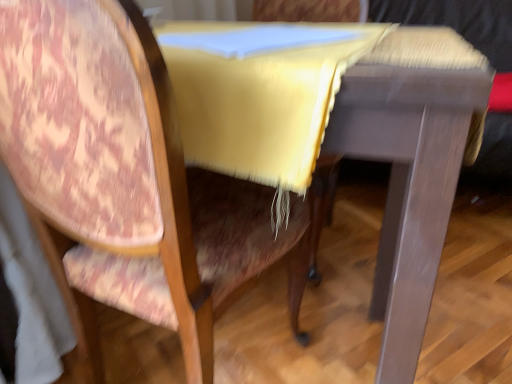
Question: Does wooden table at center appear on the left side of velvet-like pink chair at left?

Choices:
 (A) no
 (B) yes

Answer: (A)

Question: Is wooden table at center outside of velvet-like pink chair at left?

Choices:
 (A) yes
 (B) no

Answer: (B)

Question: From a real-world perspective, is wooden table at center beneath velvet-like pink chair at left?

Choices:
 (A) yes
 (B) no

Answer: (A)

Question: Is wooden table at center not close to velvet-like pink chair at left?

Choices:
 (A) yes
 (B) no

Answer: (B)

Question: From the image's perspective, is wooden table at center on velvet-like pink chair at left?

Choices:
 (A) yes
 (B) no

Answer: (A)

Question: Is wooden table at center oriented away from velvet-like pink chair at left?

Choices:
 (A) yes
 (B) no

Answer: (A)

Question: Considering the relative sizes of velvet-like pink chair at left and wooden table at center in the image provided, is velvet-like pink chair at left bigger than wooden table at center?

Choices:
 (A) yes
 (B) no

Answer: (B)

Question: Is there a large distance between velvet-like pink chair at left and wooden table at center?

Choices:
 (A) yes
 (B) no

Answer: (B)

Question: Are velvet-like pink chair at left and wooden table at center making contact?

Choices:
 (A) yes
 (B) no

Answer: (B)

Question: From a real-world perspective, is velvet-like pink chair at left positioned over wooden table at center based on gravity?

Choices:
 (A) yes
 (B) no

Answer: (A)

Question: Would you say wooden table at center is part of velvet-like pink chair at left's contents?

Choices:
 (A) yes
 (B) no

Answer: (A)

Question: Can you confirm if velvet-like pink chair at left is shorter than wooden table at center?

Choices:
 (A) no
 (B) yes

Answer: (A)

Question: Visually, is wooden table at center positioned to the left or to the right of velvet-like pink chair at left?

Choices:
 (A) right
 (B) left

Answer: (A)